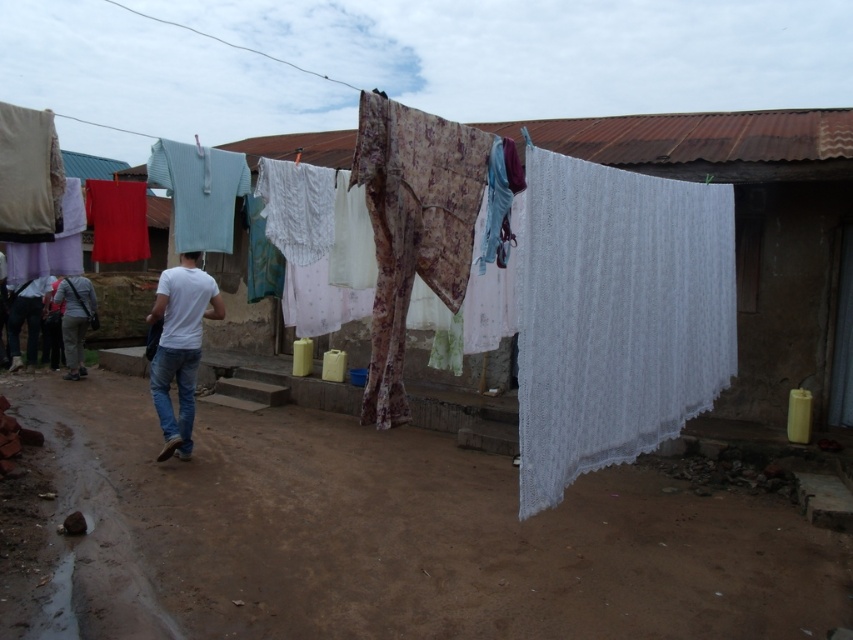
From the picture: Measure the distance between brown dirt track at lower center and camera.

brown dirt track at lower center and camera are 3.82 meters apart.

Can you confirm if brown dirt track at lower center is taller than white lace cloth at center?

In fact, brown dirt track at lower center may be shorter than white lace cloth at center.

Between point (370, 595) and point (689, 410), which one is positioned in front?

Positioned in front is point (689, 410).

Find the location of `brown dirt track at lower center`. brown dirt track at lower center is located at coordinates (405, 536).

Who is more forward, (570, 355) or (183, 365)?

Point (570, 355)

Does white lace cloth at center have a greater height compared to jeans at center?

Yes.

Where is `white lace cloth at center`? The image size is (853, 640). white lace cloth at center is located at coordinates (614, 314).

Is white matte t-shirt at lower left thinner than jeans at center?

No, white matte t-shirt at lower left is not thinner than jeans at center.

Who is more distant from viewer, (155, 365) or (189, 406)?

The point (189, 406) is behind.

This screenshot has width=853, height=640. I want to click on white matte t-shirt at lower left, so click(x=178, y=346).